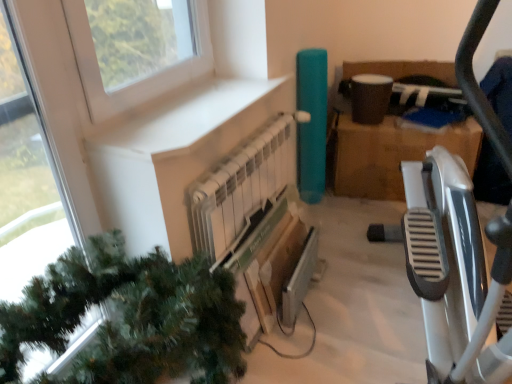
Question: Is transparent glass window at upper left inside or outside of brown cardboard box at center-right?

Choices:
 (A) inside
 (B) outside

Answer: (B)

Question: Looking at their shapes, would you say transparent glass window at upper left is wider or thinner than brown cardboard box at center-right?

Choices:
 (A) thin
 (B) wide

Answer: (A)

Question: Which object is positioned closest to the white metallic radiator at center?

Choices:
 (A) transparent glass window at upper left
 (B) brown cardboard box at center-right
 (C) white matte window sill at upper left
 (D) green matte christmas tree at lower left
 (E) metallic silver tv at center

Answer: (C)

Question: Considering the real-world distances, which object is closest to the white metallic radiator at center?

Choices:
 (A) white matte window sill at upper left
 (B) transparent glass window at upper left
 (C) metallic silver tv at center
 (D) brown cardboard box at center-right
 (E) green matte christmas tree at lower left

Answer: (A)